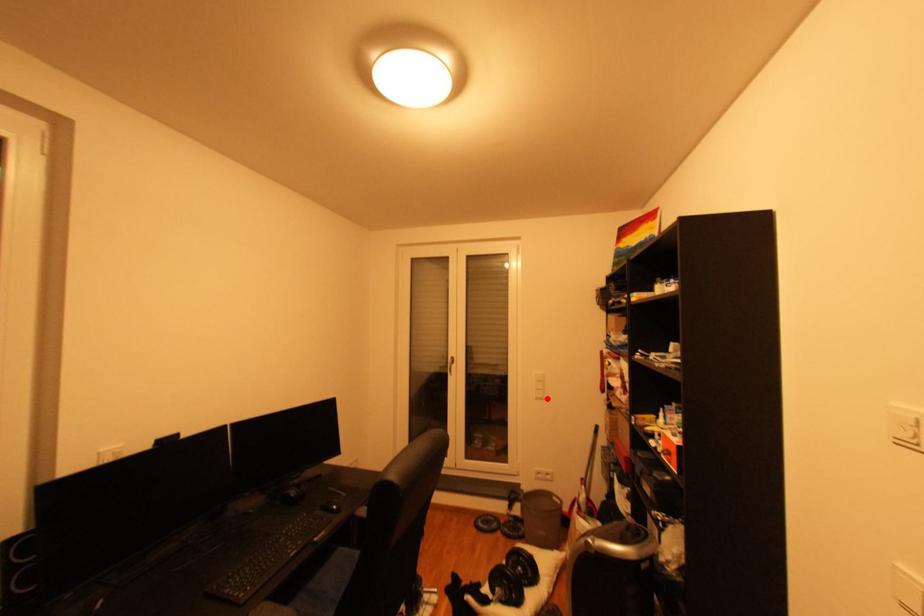
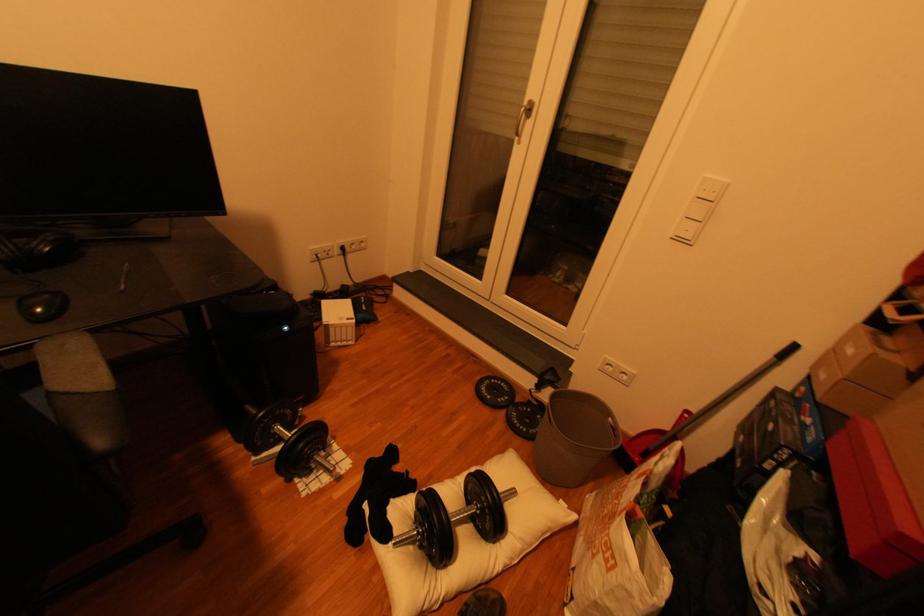
Locate, in the second image, the point that corresponds to the highlighted location in the first image.

(687, 240)